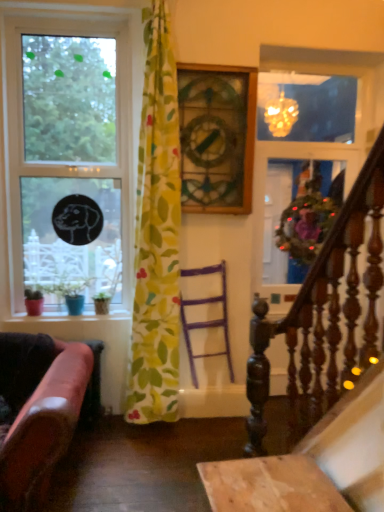
Question: Is there a large distance between purple wood chair at center and leather at left?

Choices:
 (A) no
 (B) yes

Answer: (B)

Question: Is purple wood chair at center thinner than leather at left?

Choices:
 (A) yes
 (B) no

Answer: (A)

Question: Can you confirm if purple wood chair at center is shorter than leather at left?

Choices:
 (A) yes
 (B) no

Answer: (B)

Question: Is leather at left a part of purple wood chair at center?

Choices:
 (A) yes
 (B) no

Answer: (B)

Question: From a real-world perspective, is purple wood chair at center on top of leather at left?

Choices:
 (A) no
 (B) yes

Answer: (B)

Question: Considering the positions of clear glass window at left and dark wood railing at right in the image, is clear glass window at left bigger or smaller than dark wood railing at right?

Choices:
 (A) small
 (B) big

Answer: (B)

Question: Choose the correct answer: Is clear glass window at left inside dark wood railing at right or outside it?

Choices:
 (A) inside
 (B) outside

Answer: (B)

Question: In terms of height, does clear glass window at left look taller or shorter compared to dark wood railing at right?

Choices:
 (A) short
 (B) tall

Answer: (B)

Question: Looking at their shapes, would you say clear glass window at left is wider or thinner than dark wood railing at right?

Choices:
 (A) thin
 (B) wide

Answer: (B)

Question: Is decorative wreath at upper right in front of or behind clear glass window at left in the image?

Choices:
 (A) front
 (B) behind

Answer: (B)

Question: From the image's perspective, is decorative wreath at upper right above or below clear glass window at left?

Choices:
 (A) below
 (B) above

Answer: (A)

Question: Would you say decorative wreath at upper right is inside or outside clear glass window at left?

Choices:
 (A) inside
 (B) outside

Answer: (B)

Question: Is decorative wreath at upper right to the left or to the right of clear glass window at left in the image?

Choices:
 (A) right
 (B) left

Answer: (A)

Question: From the image's perspective, is yellow floral fabric at center above or below decorative wreath at upper right?

Choices:
 (A) below
 (B) above

Answer: (A)

Question: In the image, is yellow floral fabric at center on the left side or the right side of decorative wreath at upper right?

Choices:
 (A) right
 (B) left

Answer: (B)